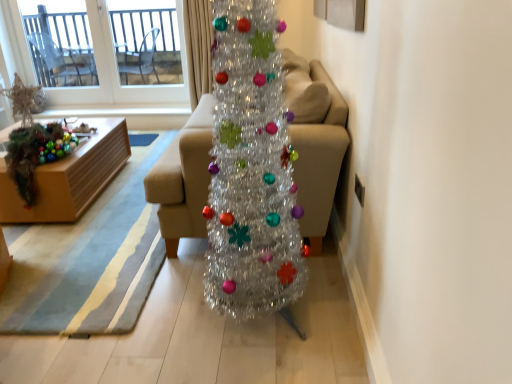
Question: In terms of width, does wooden box at left look wider or thinner when compared to shiny beige curtain at upper center?

Choices:
 (A) thin
 (B) wide

Answer: (B)

Question: In the image, is wooden box at left positioned in front of or behind shiny beige curtain at upper center?

Choices:
 (A) behind
 (B) front

Answer: (B)

Question: Based on their relative distances, which object is nearer to the wooden box at left?

Choices:
 (A) shiny beige curtain at upper center
 (B) shiny metallic christmas tree at center
 (C) beige fabric couch at center
 (D) transparent glass window at upper left
 (E) transparent glass door at upper left

Answer: (A)

Question: Which of these objects is positioned farthest from the shiny beige curtain at upper center?

Choices:
 (A) transparent glass door at upper left
 (B) transparent glass window at upper left
 (C) shiny metallic christmas tree at center
 (D) beige fabric couch at center
 (E) wooden box at left

Answer: (C)